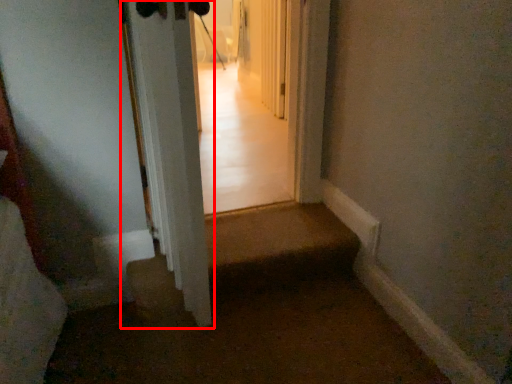
Question: Observing the image, what is the correct spatial positioning of door (annotated by the red box) in reference to corridor?

Choices:
 (A) right
 (B) left

Answer: (B)